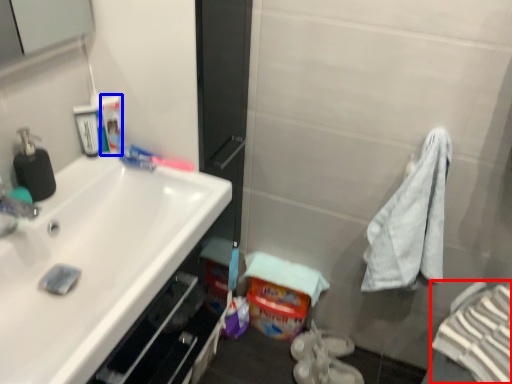
Question: Among these objects, which one is farthest to the camera, bath towel (highlighted by a red box) or mouthwash (highlighted by a blue box)?

Choices:
 (A) bath towel
 (B) mouthwash

Answer: (B)